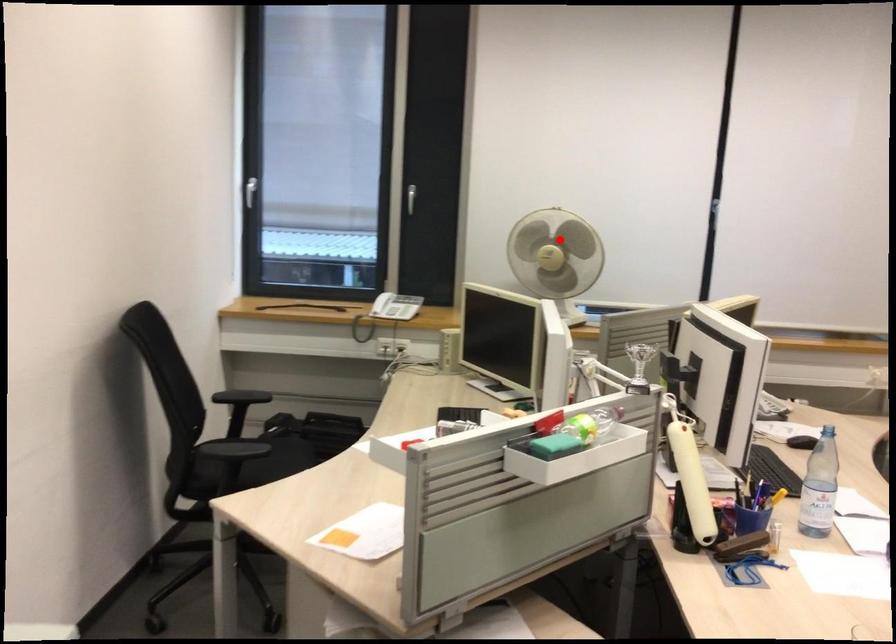
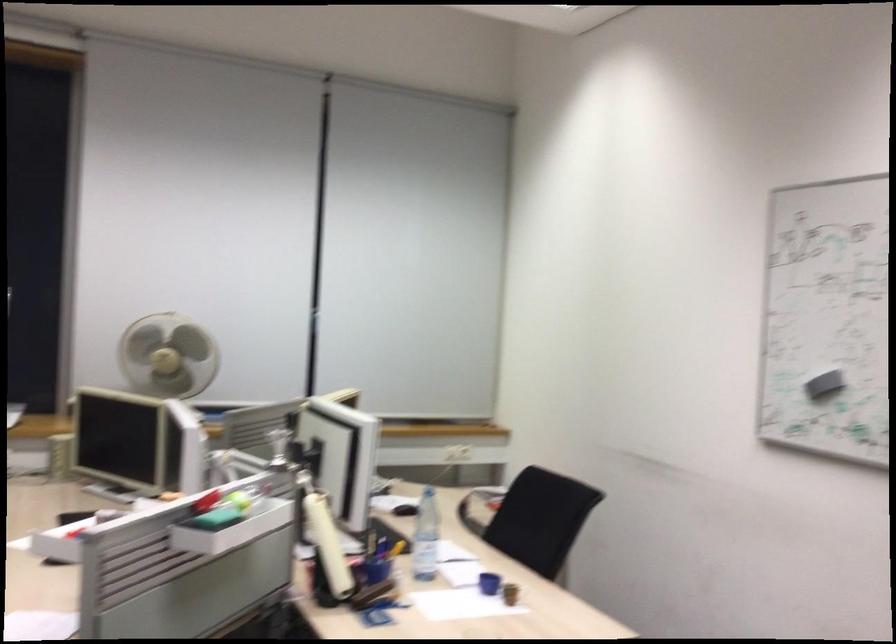
Question: A red point is marked in image1. In image2, is the corresponding 3D point closer to the camera or farther? Reply with the corresponding letter.

Choices:
 (A) The corresponding 3D point is closer.
 (B) The corresponding 3D point is farther.

Answer: (B)